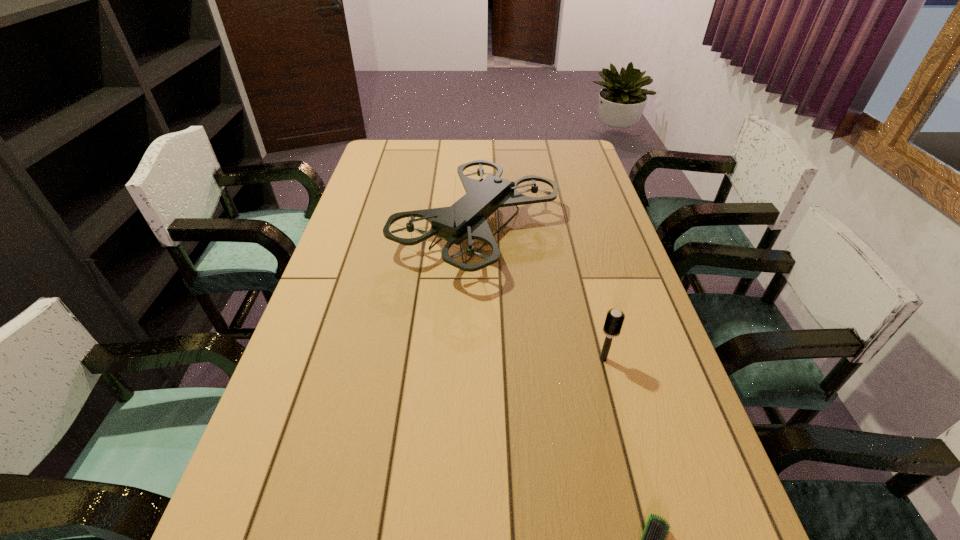
Find the location of a particular element. This screenshot has height=540, width=960. free space at the right edge of the desktop is located at coordinates click(x=595, y=334).

In the image, there is a desktop. Identify the location of vacant space at the far left corner. The image size is (960, 540). (398, 147).

Find the location of a particular element. The height and width of the screenshot is (540, 960). free space between the drone and the taller hairbrush is located at coordinates (540, 294).

Where is `vacant area that lies between the farthest object and the second farthest object`? Image resolution: width=960 pixels, height=540 pixels. vacant area that lies between the farthest object and the second farthest object is located at coordinates (540, 294).

This screenshot has height=540, width=960. What are the coordinates of `free space between the second farthest object and the tallest object` in the screenshot? It's located at (540, 294).

Find the location of a particular element. object that ranks as the closest to the farther hairbrush is located at coordinates (466, 219).

Find the location of `the closest object relative to the shorter hairbrush`. the closest object relative to the shorter hairbrush is located at coordinates (614, 320).

You are a GUI agent. You are given a task and a screenshot of the screen. Output one action in this format:
    pyautogui.click(x=<x>, y=<y>)
    Task: Click on the vacant space that satisfies the following two spatial constraints: 1. on the front side of the second tallest object; 2. on the right side of the drone
    Image resolution: width=960 pixels, height=540 pixels.
    Given the screenshot: What is the action you would take?
    pyautogui.click(x=475, y=359)